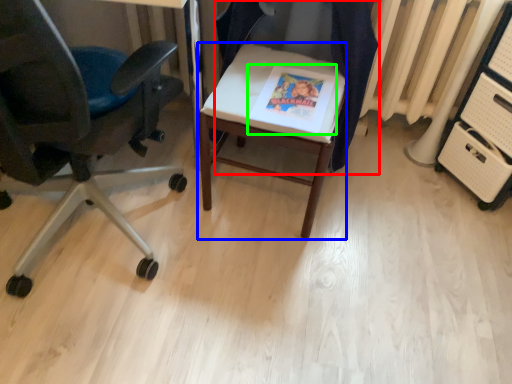
Question: Which object is the closest to the chair (highlighted by a red box)? Choose among these: desk (highlighted by a blue box) or magazine (highlighted by a green box).

Choices:
 (A) desk
 (B) magazine

Answer: (B)